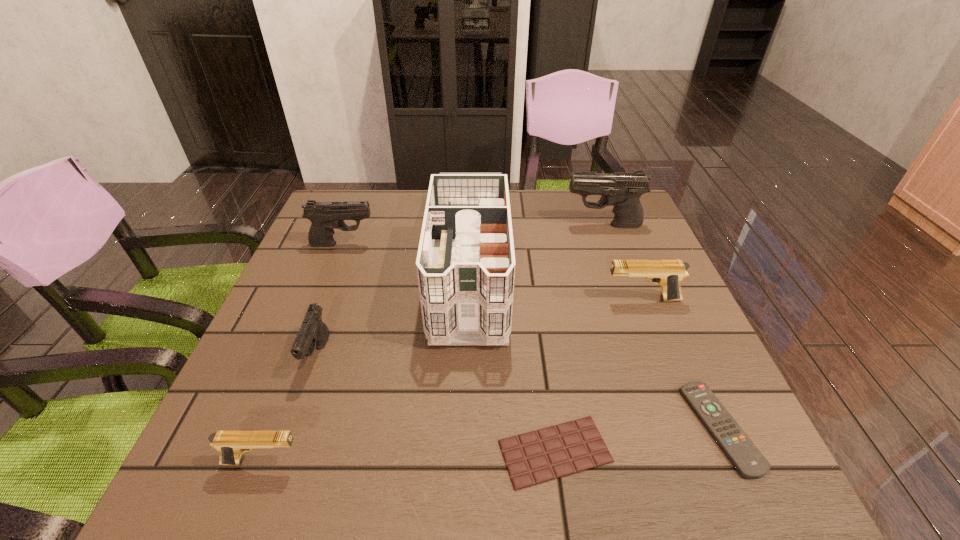
What are the coordinates of `dollhouse` in the screenshot? It's located at (465, 264).

Where is `the biggest black pistol`? the biggest black pistol is located at coordinates coord(622,190).

Locate an element on the screen. the seventh shortest object is located at coordinates (622, 190).

At what (x,y) coordinates should I click in order to perform the action: click on the second farthest pistol. Please return your answer as a coordinate pair (x, y). Looking at the image, I should click on (325, 216).

Image resolution: width=960 pixels, height=540 pixels. Identify the location of the second nearest black pistol. (325, 216).

This screenshot has width=960, height=540. Find the location of `the right tan pistol`. the right tan pistol is located at coordinates (668, 274).

This screenshot has width=960, height=540. Identify the location of the farther tan pistol. (668, 274).

Identify the location of the nearest black pistol. (313, 333).

Identify the location of the smallest black pistol. The image size is (960, 540). (313, 333).

The height and width of the screenshot is (540, 960). I want to click on the nearer tan pistol, so click(231, 444).